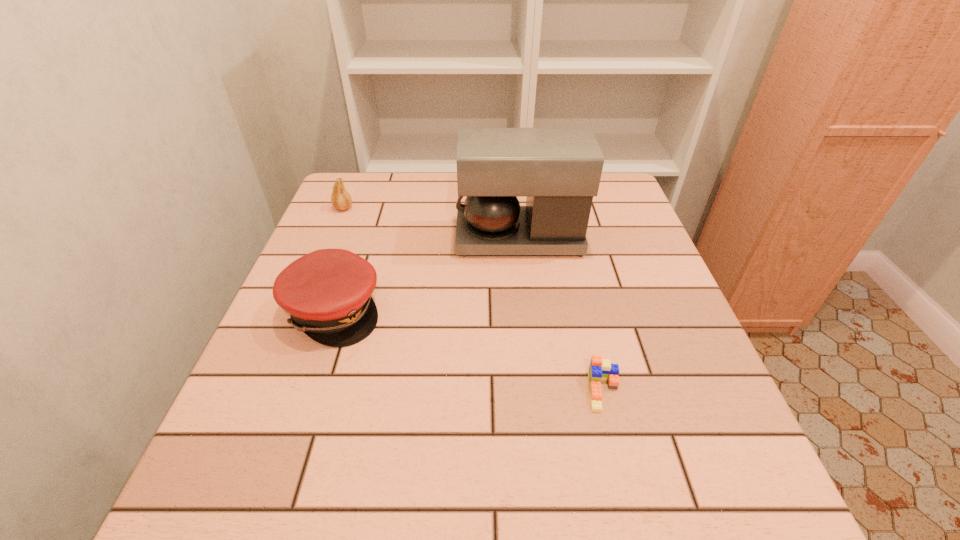
Identify which object is the third closest to the pear. Please provide its 2D coordinates. Your answer should be formatted as a tuple, i.e. [(x, y)], where the tuple contains the x and y coordinates of a point satisfying the conditions above.

[(599, 369)]

You are a GUI agent. You are given a task and a screenshot of the screen. Output one action in this format:
    pyautogui.click(x=<x>, y=<y>)
    Task: Click on the vacant space that satisfies the following two spatial constraints: 1. on the carafe side of the tallest object; 2. on the right side of the shortest object
    The height and width of the screenshot is (540, 960).
    Given the screenshot: What is the action you would take?
    pyautogui.click(x=537, y=392)

At what (x,y) coordinates should I click in order to perform the action: click on vacant space that satisfies the following two spatial constraints: 1. at the front of the cap where the visor is located; 2. on the right side of the nearest object. Please return your answer as a coordinate pair (x, y). The image size is (960, 540). Looking at the image, I should click on (306, 392).

The height and width of the screenshot is (540, 960). What are the coordinates of `free space in the image that satisfies the following two spatial constraints: 1. at the front of the nearest object where the visor is located; 2. on the left side of the third farthest object` in the screenshot? It's located at (306, 392).